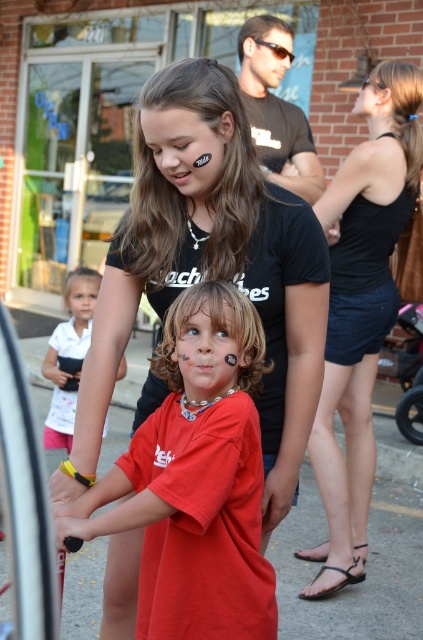
Question: Which point appears closest to the camera in this image?

Choices:
 (A) (192, 362)
 (B) (376, 172)
 (C) (85, 353)

Answer: (A)

Question: Considering the real-world distances, which object is closest to the matte red shirt at center?

Choices:
 (A) matte black shirt at center
 (B) black denim shorts at lower right
 (C) white matte shirt at lower left

Answer: (A)

Question: Considering the real-world distances, which object is farthest from the matte red shirt at center?

Choices:
 (A) white matte shirt at lower left
 (B) matte black shirt at center
 (C) black denim shorts at lower right

Answer: (A)

Question: Is matte red shirt at center smaller than black denim shorts at lower right?

Choices:
 (A) yes
 (B) no

Answer: (A)

Question: Does black denim shorts at lower right lie behind white matte shirt at lower left?

Choices:
 (A) no
 (B) yes

Answer: (A)

Question: Does matte black shirt at center have a greater width compared to black denim shorts at lower right?

Choices:
 (A) no
 (B) yes

Answer: (B)